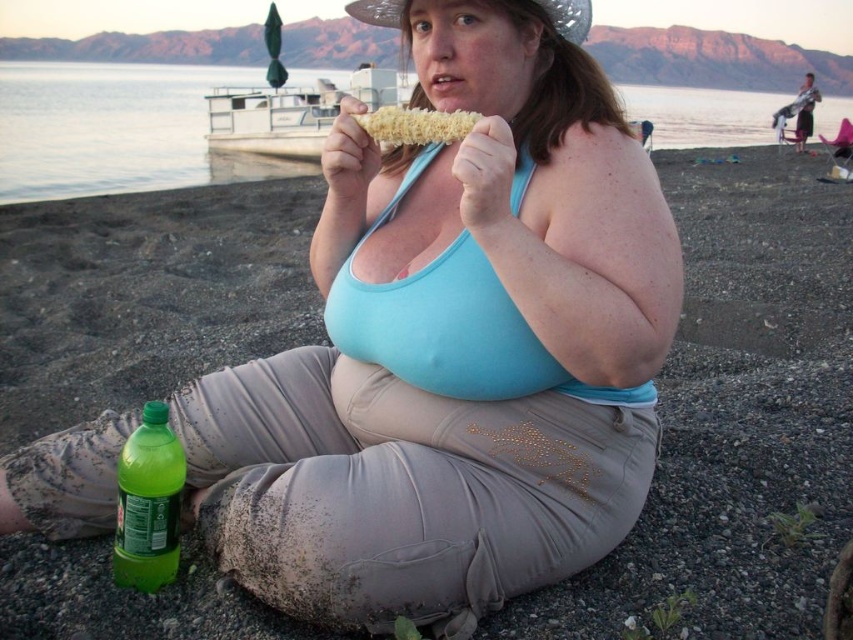
Question: Which of the following is the closest to the observer?

Choices:
 (A) golden corn at center
 (B) green plastic bottle at lower left

Answer: (A)

Question: Does clear water at center have a lesser width compared to green plastic bottle at lower left?

Choices:
 (A) no
 (B) yes

Answer: (A)

Question: Which of these objects is positioned farthest from the green plastic bottle at lower left?

Choices:
 (A) clear water at center
 (B) golden corn at center

Answer: (A)

Question: Is clear water at center bigger than green plastic bottle at lower left?

Choices:
 (A) yes
 (B) no

Answer: (A)

Question: Based on their relative distances, which object is farther from the golden corn at center?

Choices:
 (A) green plastic bottle at lower left
 (B) clear water at center

Answer: (B)

Question: Where is clear water at center located in relation to golden corn at center in the image?

Choices:
 (A) left
 (B) right

Answer: (B)